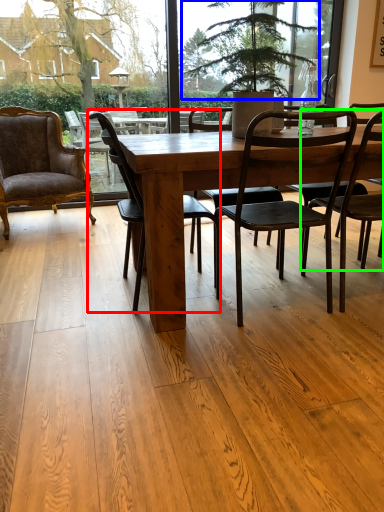
Question: Which is farther away from chair (highlighted by a red box)? tree (highlighted by a blue box) or chair (highlighted by a green box)?

Choices:
 (A) tree
 (B) chair

Answer: (A)